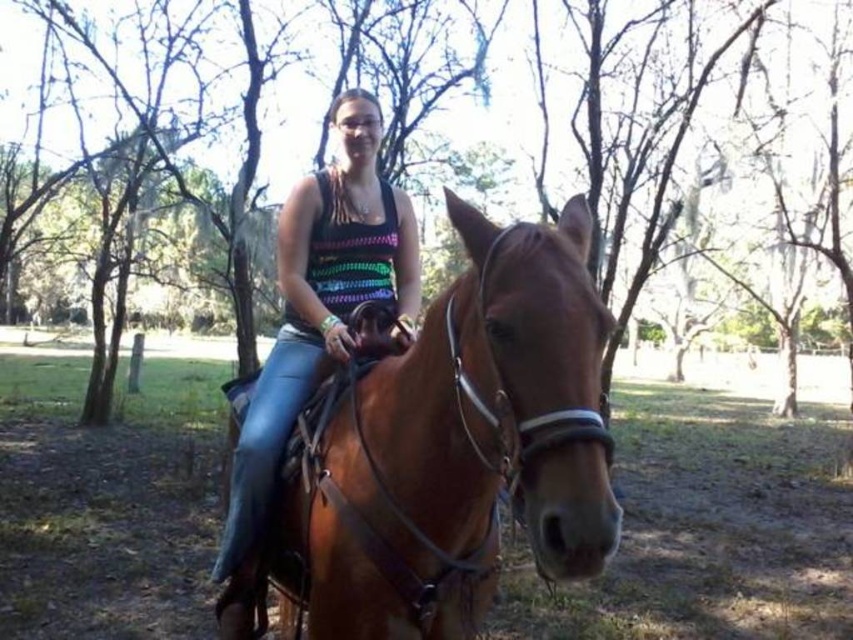
How far apart are brown wood tree at center and brown leather horse at center?

brown wood tree at center and brown leather horse at center are 10.38 feet apart from each other.

Between brown wood tree at center and brown leather horse at center, which one has more height?

brown wood tree at center

Locate an element on the screen. Image resolution: width=853 pixels, height=640 pixels. brown wood tree at center is located at coordinates click(693, 148).

You are a GUI agent. You are given a task and a screenshot of the screen. Output one action in this format:
    pyautogui.click(x=<x>, y=<y>)
    Task: Click on the brown wood tree at center
    
    Given the screenshot: What is the action you would take?
    pyautogui.click(x=693, y=148)